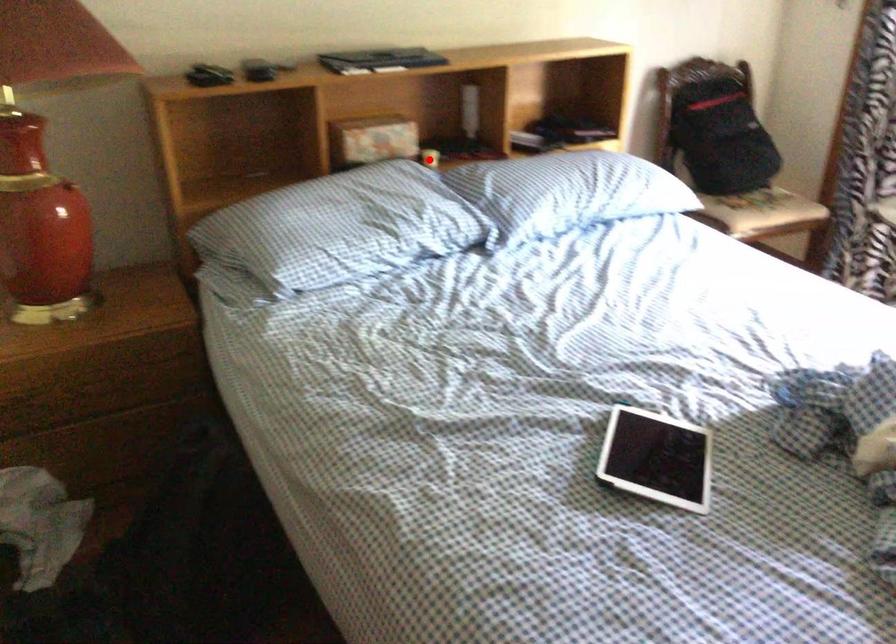
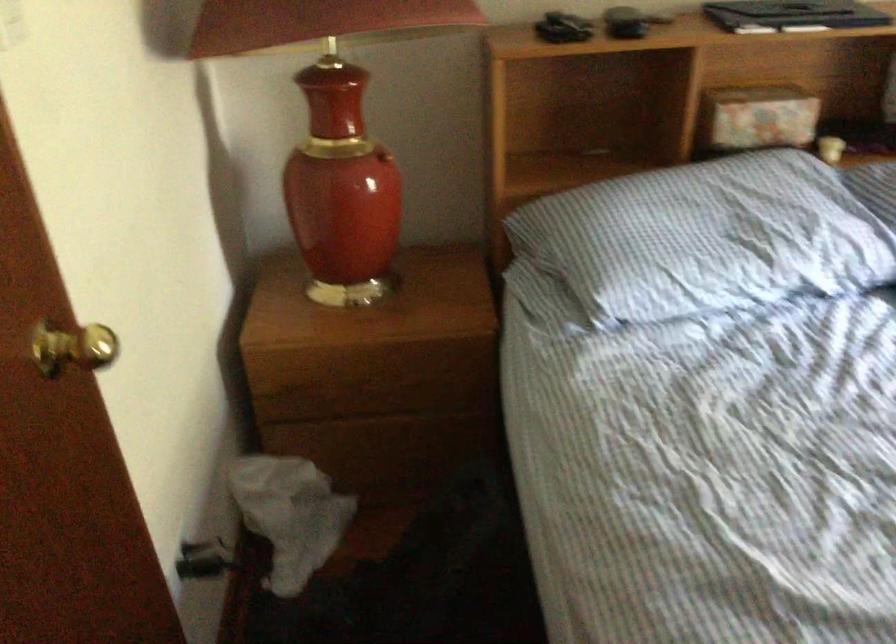
Find the pixel in the second image that matches the highlighted location in the first image.

(830, 149)